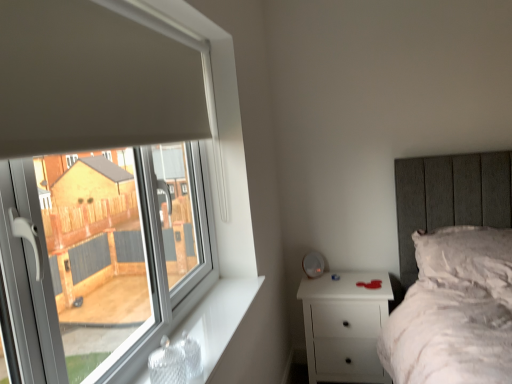
Question: Does white matte nightstand at lower right come in front of white fluffy pillow at upper right?

Choices:
 (A) no
 (B) yes

Answer: (A)

Question: Does white matte nightstand at lower right have a greater height compared to white fluffy pillow at upper right?

Choices:
 (A) yes
 (B) no

Answer: (A)

Question: From the image's perspective, would you say white matte nightstand at lower right is positioned over white fluffy pillow at upper right?

Choices:
 (A) no
 (B) yes

Answer: (A)

Question: Is white matte nightstand at lower right not near white fluffy pillow at upper right?

Choices:
 (A) yes
 (B) no

Answer: (B)

Question: From the image's perspective, is white matte nightstand at lower right located beneath white fluffy pillow at upper right?

Choices:
 (A) no
 (B) yes

Answer: (B)

Question: Is white matte nightstand at lower right bigger or smaller than white fluffy pillow at upper right?

Choices:
 (A) small
 (B) big

Answer: (B)

Question: Choose the correct answer: Is white matte nightstand at lower right inside white fluffy pillow at upper right or outside it?

Choices:
 (A) inside
 (B) outside

Answer: (B)

Question: From the image's perspective, relative to white fluffy pillow at upper right, is white matte nightstand at lower right above or below?

Choices:
 (A) above
 (B) below

Answer: (B)

Question: From a real-world perspective, is white matte nightstand at lower right physically located above or below white fluffy pillow at upper right?

Choices:
 (A) below
 (B) above

Answer: (A)

Question: In terms of width, does white glossy window sill at lower left look wider or thinner when compared to white plastic window at left?

Choices:
 (A) wide
 (B) thin

Answer: (A)

Question: From the image's perspective, is white glossy window sill at lower left above or below white plastic window at left?

Choices:
 (A) below
 (B) above

Answer: (A)

Question: Do you think white glossy window sill at lower left is within white plastic window at left, or outside of it?

Choices:
 (A) inside
 (B) outside

Answer: (B)

Question: Considering their positions, is white glossy window sill at lower left located in front of or behind white plastic window at left?

Choices:
 (A) behind
 (B) front

Answer: (A)

Question: From a real-world perspective, is white plastic window at left above or below white fluffy pillow at upper right?

Choices:
 (A) above
 (B) below

Answer: (A)

Question: In terms of width, does white plastic window at left look wider or thinner when compared to white fluffy pillow at upper right?

Choices:
 (A) thin
 (B) wide

Answer: (A)